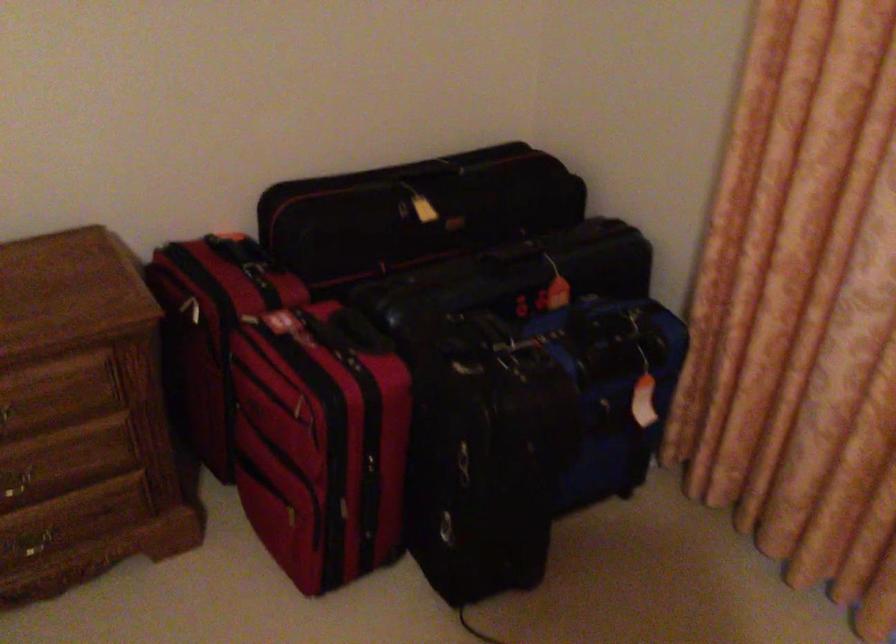
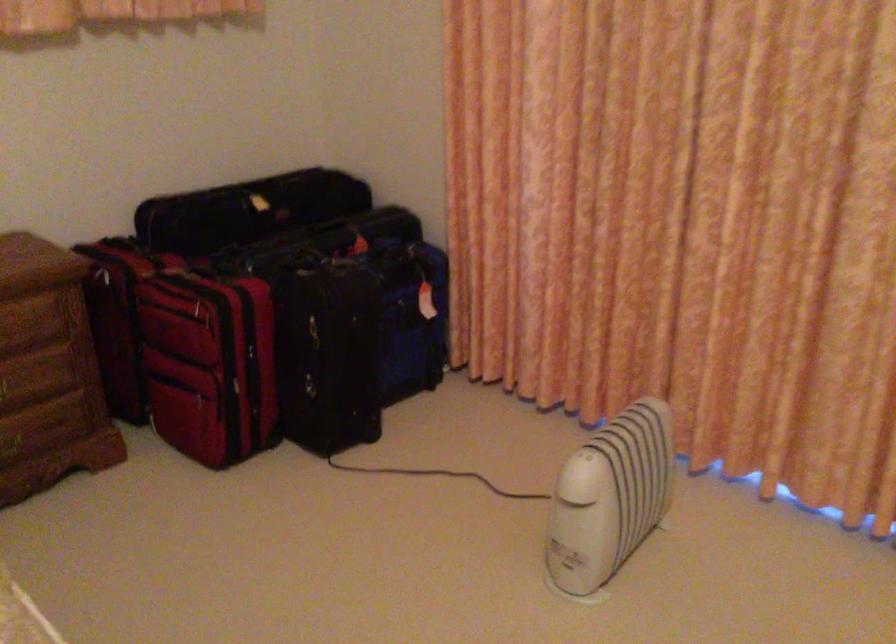
The point at (401, 222) is marked in the first image. Where is the corresponding point in the second image?

(247, 210)